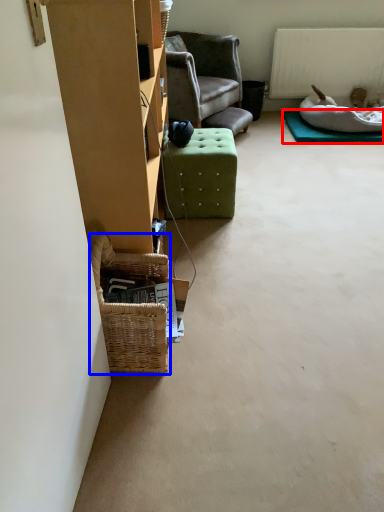
Question: Among these objects, which one is farthest to the camera, mat (highlighted by a red box) or picnic basket (highlighted by a blue box)?

Choices:
 (A) mat
 (B) picnic basket

Answer: (A)